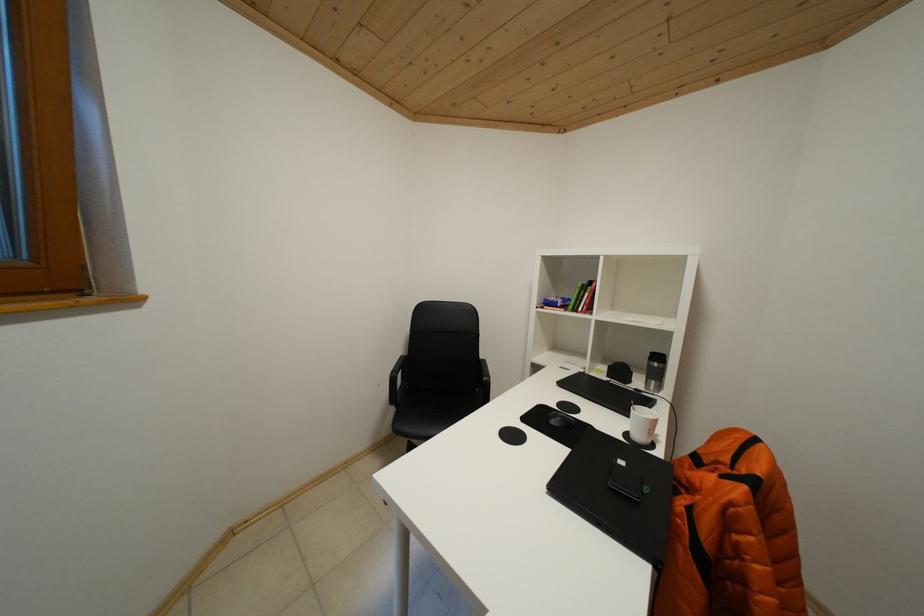
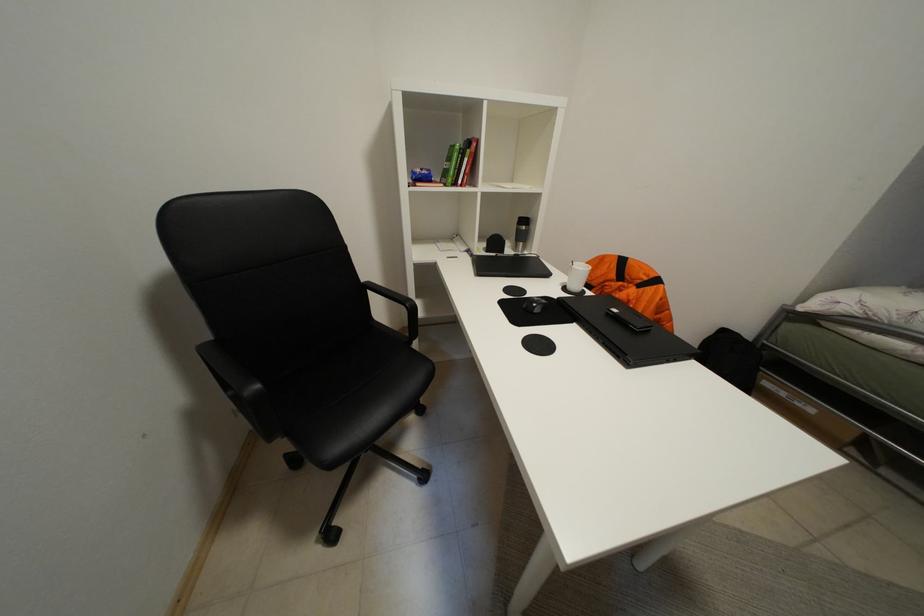
How did the camera likely rotate?

The camera's rotation is toward right-down.